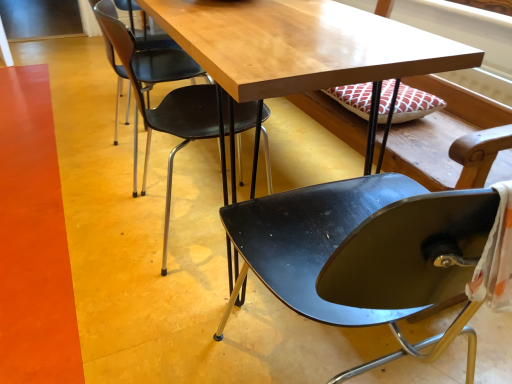
Question: Does wooden table at center appear on the left side of black plastic chair at upper center, which is the 2th chair from right to left?

Choices:
 (A) yes
 (B) no

Answer: (B)

Question: Is wooden table at center far away from black plastic chair at upper center, which is the 2th chair from right to left?

Choices:
 (A) no
 (B) yes

Answer: (A)

Question: Could you tell me if wooden table at center is facing black plastic chair at upper center, which is the 2th chair from right to left?

Choices:
 (A) yes
 (B) no

Answer: (A)

Question: Is wooden table at center smaller than black plastic chair at upper center, acting as the 1th chair starting from the left?

Choices:
 (A) yes
 (B) no

Answer: (B)

Question: Does wooden table at center lie behind black plastic chair at upper center, which is the 2th chair from right to left?

Choices:
 (A) no
 (B) yes

Answer: (A)

Question: Is glossy black chair at center, which is counted as the 2th chair, starting from the left, inside or outside of wooden table at center?

Choices:
 (A) outside
 (B) inside

Answer: (A)

Question: Considering the positions of point (497, 132) and point (283, 84), is point (497, 132) closer or farther from the camera than point (283, 84)?

Choices:
 (A) closer
 (B) farther

Answer: (B)

Question: From a real-world perspective, is glossy black chair at center, which is counted as the 2th chair, starting from the left, physically located above or below wooden table at center?

Choices:
 (A) below
 (B) above

Answer: (A)

Question: Based on their sizes in the image, would you say glossy black chair at center, arranged as the 1th chair when viewed from the right, is bigger or smaller than wooden table at center?

Choices:
 (A) small
 (B) big

Answer: (A)

Question: In the image, is black plastic chair at upper center, acting as the 1th chair starting from the left, positioned in front of or behind glossy black chair at center, arranged as the 1th chair when viewed from the right?

Choices:
 (A) behind
 (B) front

Answer: (A)

Question: Is black plastic chair at upper center, acting as the 1th chair starting from the left, inside the boundaries of glossy black chair at center, arranged as the 1th chair when viewed from the right, or outside?

Choices:
 (A) inside
 (B) outside

Answer: (B)

Question: In terms of height, does black plastic chair at upper center, which is the 2th chair from right to left, look taller or shorter compared to glossy black chair at center, arranged as the 1th chair when viewed from the right?

Choices:
 (A) tall
 (B) short

Answer: (B)

Question: In terms of size, does black plastic chair at upper center, which is the 2th chair from right to left, appear bigger or smaller than glossy black chair at center, which is counted as the 2th chair, starting from the left?

Choices:
 (A) small
 (B) big

Answer: (A)

Question: Is black plastic chair at upper center, which is the 2th chair from right to left, bigger or smaller than wooden table at center?

Choices:
 (A) big
 (B) small

Answer: (B)

Question: Is black plastic chair at upper center, acting as the 1th chair starting from the left, taller or shorter than wooden table at center?

Choices:
 (A) short
 (B) tall

Answer: (A)